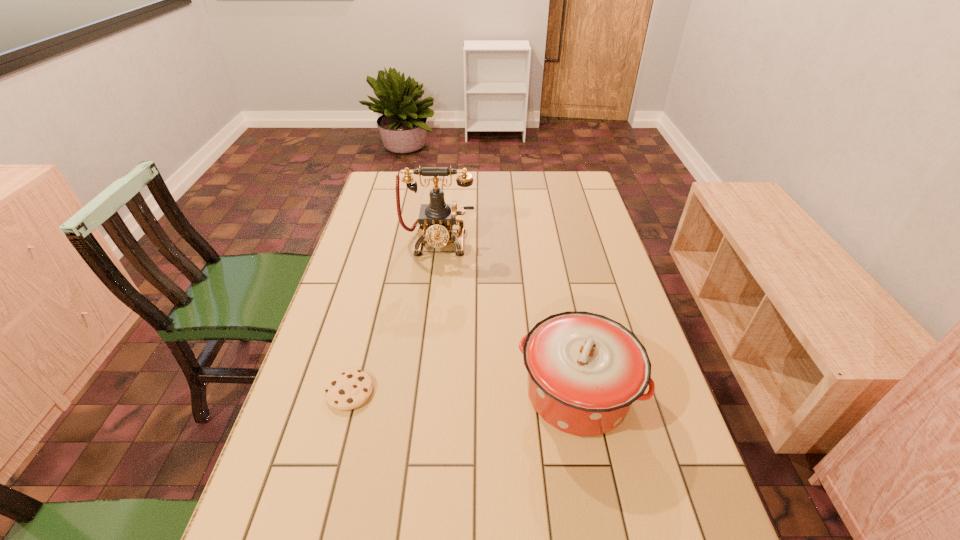
Image resolution: width=960 pixels, height=540 pixels. What are the coordinates of `the farthest object` in the screenshot? It's located at (436, 219).

Locate an element on the screen. Image resolution: width=960 pixels, height=540 pixels. the tallest object is located at coordinates (436, 219).

The height and width of the screenshot is (540, 960). I want to click on the rightmost object, so click(x=585, y=370).

Where is `casserole`? The width and height of the screenshot is (960, 540). casserole is located at coordinates (585, 370).

The width and height of the screenshot is (960, 540). I want to click on the shortest object, so click(349, 389).

Where is `vacant space situated 0.210m on the front of the tallest object, featuring the rotary dial`? The image size is (960, 540). vacant space situated 0.210m on the front of the tallest object, featuring the rotary dial is located at coordinates (430, 305).

In order to click on vacant space situated 0.300m on the left of the rightmost object in this screenshot , I will do `click(391, 393)`.

Locate an element on the screen. The image size is (960, 540). vacant space located on the back of the shortest object is located at coordinates (369, 320).

The image size is (960, 540). I want to click on object situated at the left edge, so click(349, 389).

The width and height of the screenshot is (960, 540). Identify the location of object located at the right edge. (585, 370).